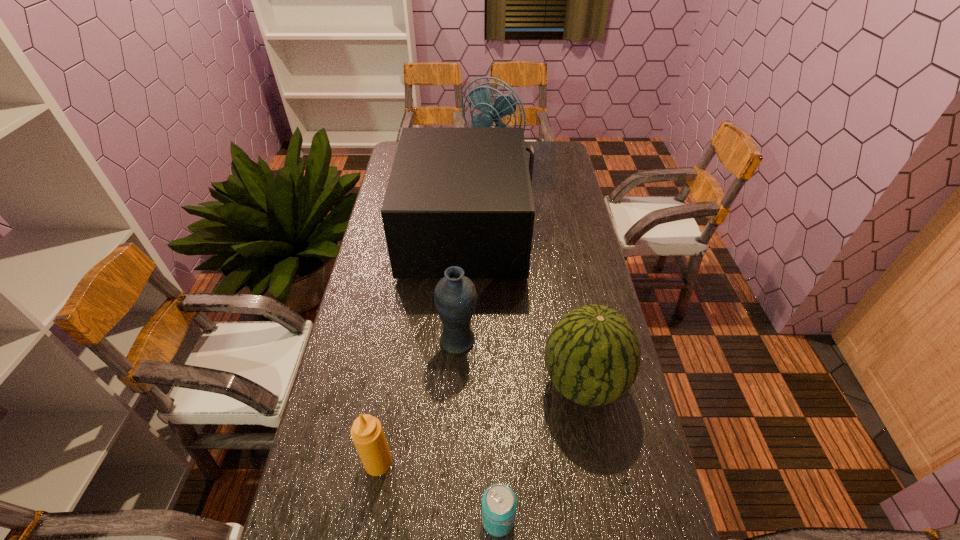
Where is `free location that satisfies the following two spatial constraints: 1. on the front-facing side of the watermelon; 2. on the left side of the microwave oven`? free location that satisfies the following two spatial constraints: 1. on the front-facing side of the watermelon; 2. on the left side of the microwave oven is located at coordinates (463, 383).

Locate an element on the screen. vacant region that satisfies the following two spatial constraints: 1. in front of the farthest object to blow air; 2. on the left side of the watermelon is located at coordinates (500, 383).

Find the location of a particular element. The height and width of the screenshot is (540, 960). vacant region that satisfies the following two spatial constraints: 1. on the front-facing side of the watermelon; 2. on the left side of the second farthest object is located at coordinates (463, 383).